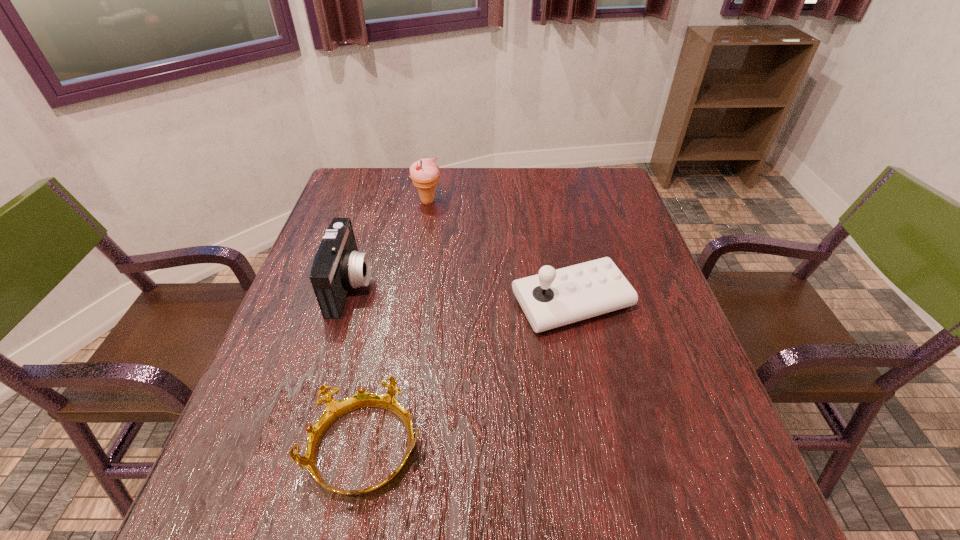
Where is `free space between the camcorder and the crown`? free space between the camcorder and the crown is located at coordinates (358, 368).

Select which object is the second closest to the farthest object. Please provide its 2D coordinates. Your answer should be formatted as a tuple, i.e. [(x, y)], where the tuple contains the x and y coordinates of a point satisfying the conditions above.

[(553, 298)]

Where is `object that ranks as the second closest to the farthest object`? The image size is (960, 540). object that ranks as the second closest to the farthest object is located at coordinates (553, 298).

Where is `vacant space that satisfies the following two spatial constraints: 1. on the front side of the farthest object; 2. on the lens of the camcorder`? The width and height of the screenshot is (960, 540). vacant space that satisfies the following two spatial constraints: 1. on the front side of the farthest object; 2. on the lens of the camcorder is located at coordinates (415, 286).

You are a GUI agent. You are given a task and a screenshot of the screen. Output one action in this format:
    pyautogui.click(x=<x>, y=<y>)
    Task: Click on the vacant space that satisfies the following two spatial constraints: 1. on the lens of the joystick; 2. on the right side of the camcorder
    The image size is (960, 540).
    Given the screenshot: What is the action you would take?
    pyautogui.click(x=346, y=302)

The image size is (960, 540). Identify the location of free region that satisfies the following two spatial constraints: 1. on the lens of the rightmost object; 2. on the right side of the camcorder. click(x=346, y=302).

In order to click on vacant region that satisfies the following two spatial constraints: 1. on the back side of the rightmost object; 2. on the lens of the camcorder in this screenshot , I will do `click(568, 286)`.

You are a GUI agent. You are given a task and a screenshot of the screen. Output one action in this format:
    pyautogui.click(x=<x>, y=<y>)
    Task: Click on the free region that satisfies the following two spatial constraints: 1. on the front side of the joystick; 2. on the right side of the farthest object
    The width and height of the screenshot is (960, 540).
    Given the screenshot: What is the action you would take?
    click(x=412, y=302)